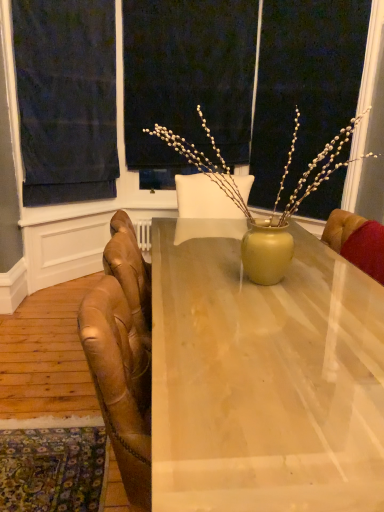
Question: Considering the positions of leather armchair at right and matte black screen at upper center in the image, is leather armchair at right taller or shorter than matte black screen at upper center?

Choices:
 (A) tall
 (B) short

Answer: (B)

Question: Which is correct: leather armchair at right is inside matte black screen at upper center, or outside of it?

Choices:
 (A) outside
 (B) inside

Answer: (A)

Question: Based on their relative distances, which object is nearer to the leather armchair at right?

Choices:
 (A) dark blue fabric at upper left
 (B) matte black screen at upper center
 (C) matte wood desk at center

Answer: (C)

Question: Which object is the closest to the dark blue fabric at upper left?

Choices:
 (A) leather armchair at right
 (B) matte wood desk at center
 (C) matte black screen at upper center

Answer: (C)